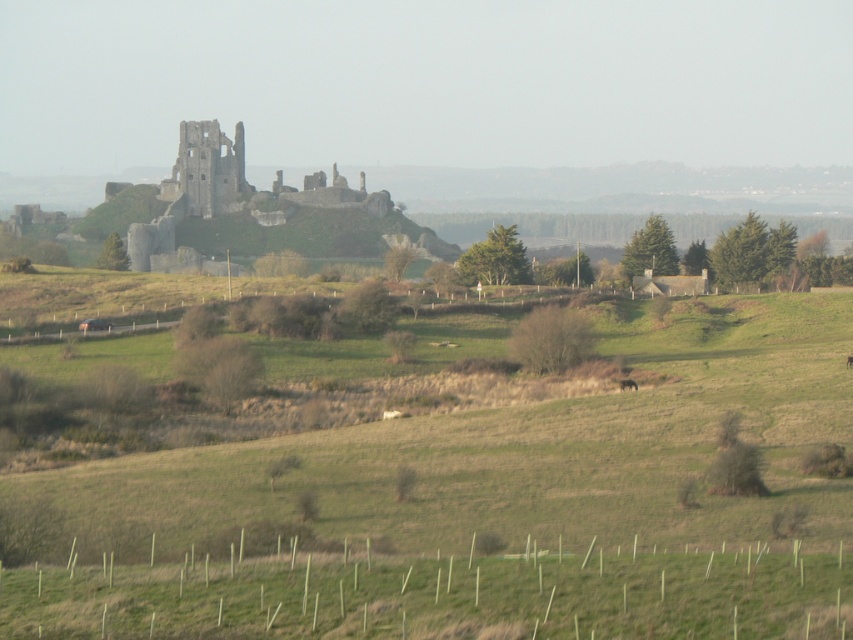
You are standing at the base of the hill in the rural landscape scene. You see two points marked on the image. Which point is closer to you, point (202, 588) or point (621, 387)?

Point (202, 588) is closer to you because it is in front of point (621, 387).

You are standing in the rural landscape looking at the historic ruin. You notice two points marked on the ground. One is at coordinate point (138, 228) and the other at point (627, 388). Which point is closer to you?

Point (138, 228) is closer to you because it is further to the viewer than point (627, 388).